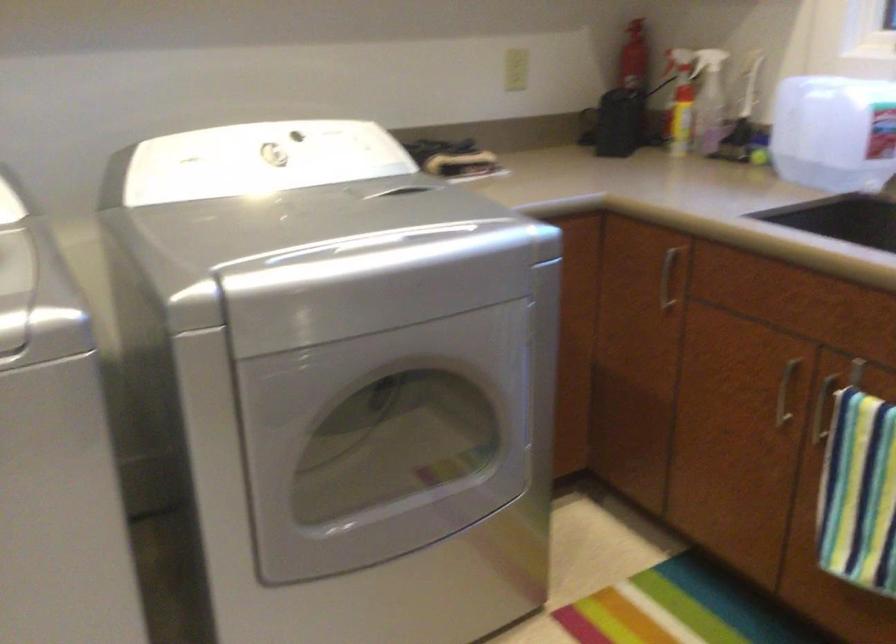
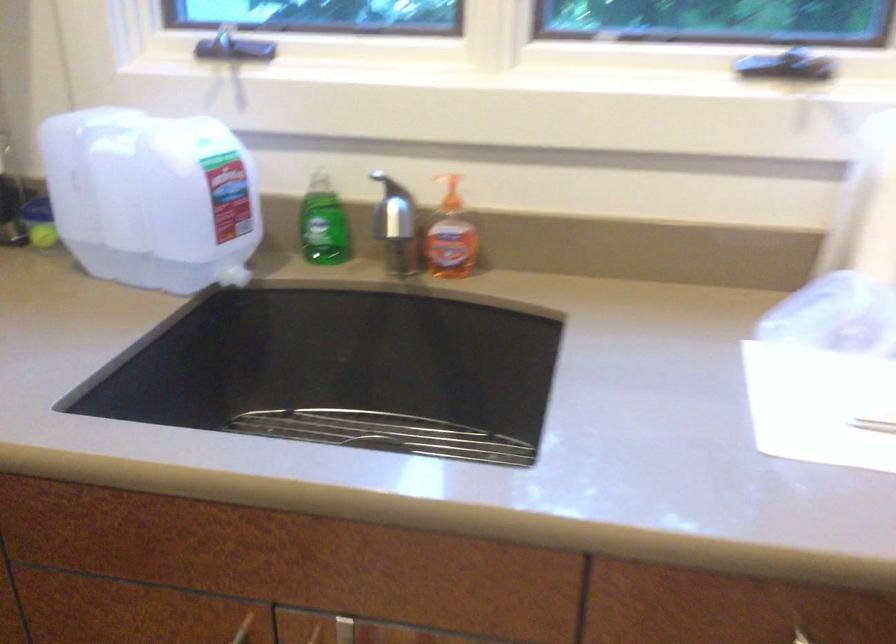
Where in the second image is the point corresponding to the point at 797,365 from the first image?

(243, 629)